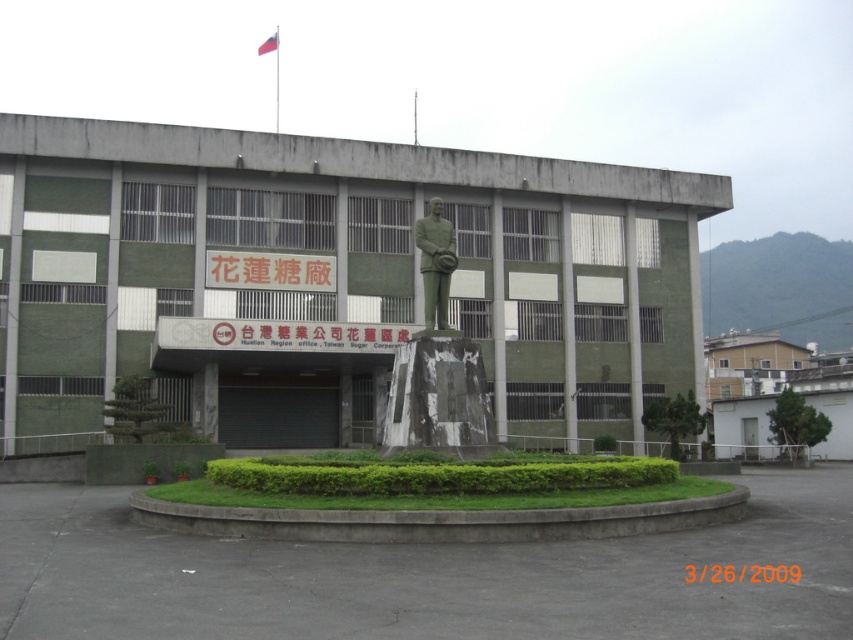
Question: Is green polished statue at center to the right of white fabric flag at upper center from the viewer's perspective?

Choices:
 (A) no
 (B) yes

Answer: (B)

Question: Which is nearer to the green polished statue at center?

Choices:
 (A) green marble statue at center
 (B) white fabric flag at upper center

Answer: (A)

Question: Which object is the farthest from the green polished statue at center?

Choices:
 (A) green marble statue at center
 (B) white fabric flag at upper center

Answer: (B)

Question: Is green polished statue at center wider than white fabric flag at upper center?

Choices:
 (A) no
 (B) yes

Answer: (A)

Question: Which object is farther from the camera taking this photo?

Choices:
 (A) green polished statue at center
 (B) green marble statue at center
 (C) white fabric flag at upper center

Answer: (C)

Question: Is green marble statue at center smaller than green polished statue at center?

Choices:
 (A) no
 (B) yes

Answer: (A)